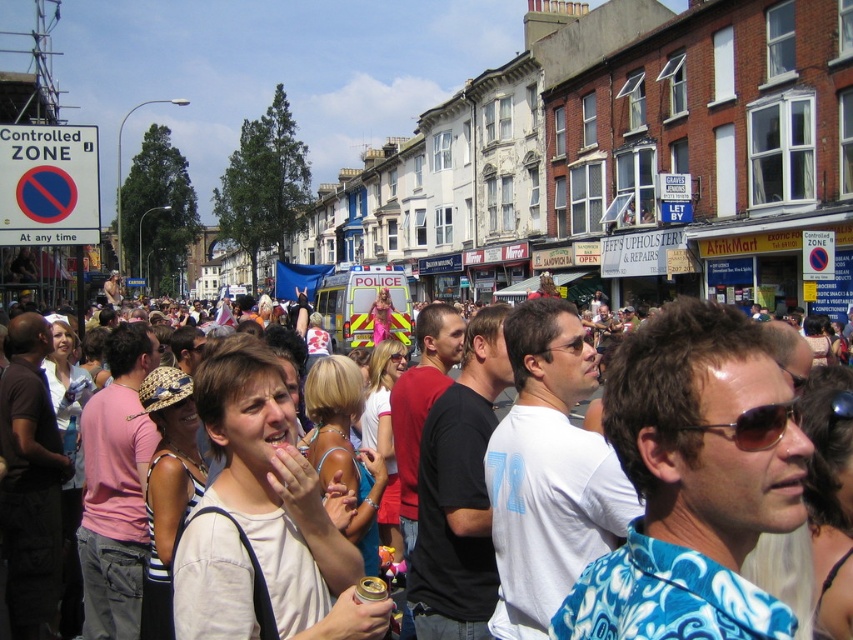
Is point (630, 380) positioned before point (751, 440)?

No, (630, 380) is behind (751, 440).

Does point (631, 442) come farther from viewer compared to point (785, 410)?

Yes, it is.

At what (x,y) coordinates should I click in order to perform the action: click on white cotton shirt at center. Please return your answer as a coordinate pair (x, y). This screenshot has height=640, width=853. Looking at the image, I should click on (691, 481).